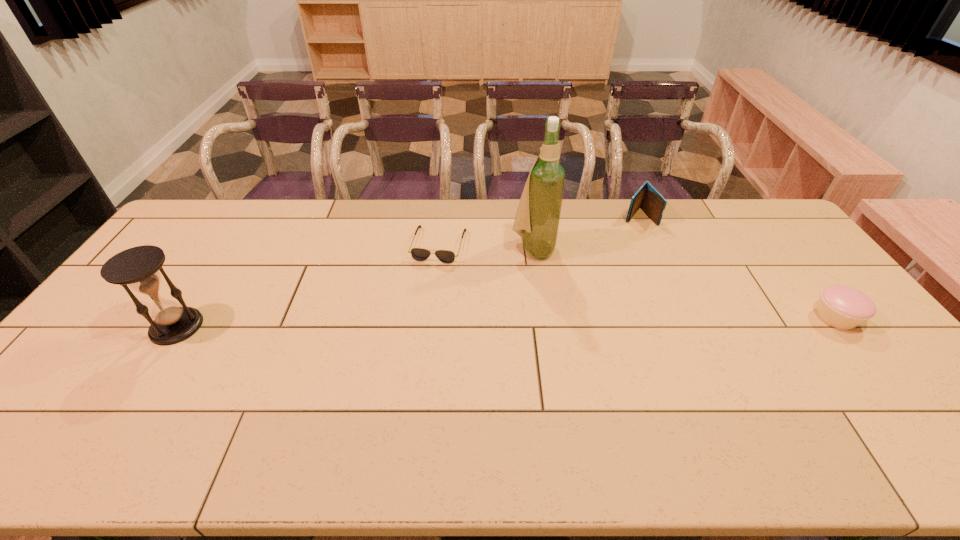
Image resolution: width=960 pixels, height=540 pixels. I want to click on hourglass, so click(x=138, y=268).

At what (x,y) coordinates should I click in order to perform the action: click on the leftmost object. Please return your answer as a coordinate pair (x, y). Looking at the image, I should click on (138, 268).

Identify the location of the rightmost object. This screenshot has width=960, height=540. (842, 307).

Locate an element on the screen. The image size is (960, 540). the fourth tallest object is located at coordinates pyautogui.click(x=842, y=307).

Where is `the tallest object`? This screenshot has width=960, height=540. the tallest object is located at coordinates (537, 219).

The image size is (960, 540). I want to click on wine bottle, so click(537, 219).

The image size is (960, 540). In order to click on the farthest object in this screenshot , I will do `click(647, 198)`.

Find the location of a particular element. The height and width of the screenshot is (540, 960). wallet is located at coordinates (647, 198).

Find the location of a particular element. the fourth object from right to left is located at coordinates (419, 254).

Locate an element on the screen. The height and width of the screenshot is (540, 960). sunglasses is located at coordinates (419, 254).